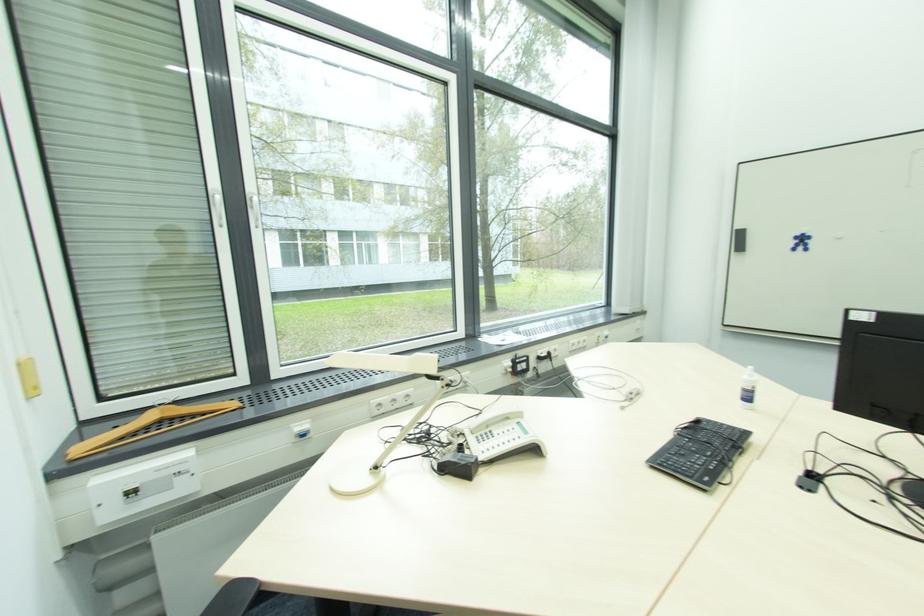
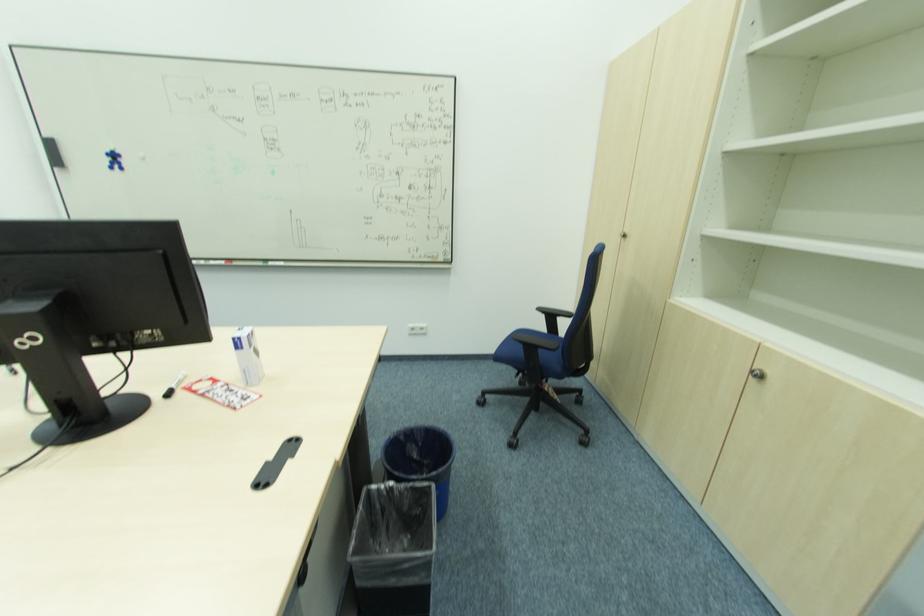
Locate, in the second image, the point that corresponds to the point at 739,230 in the first image.

(52, 140)